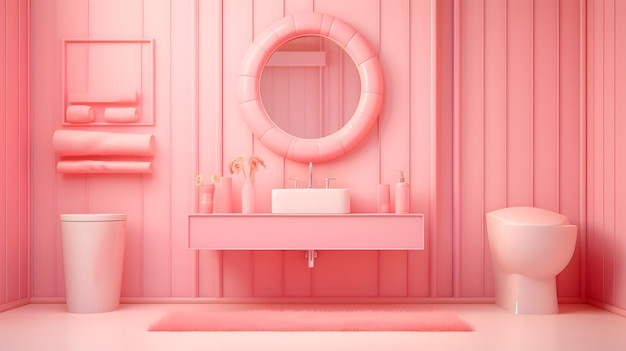
Image resolution: width=626 pixels, height=351 pixels. I want to click on pink rug, so point(357,314).